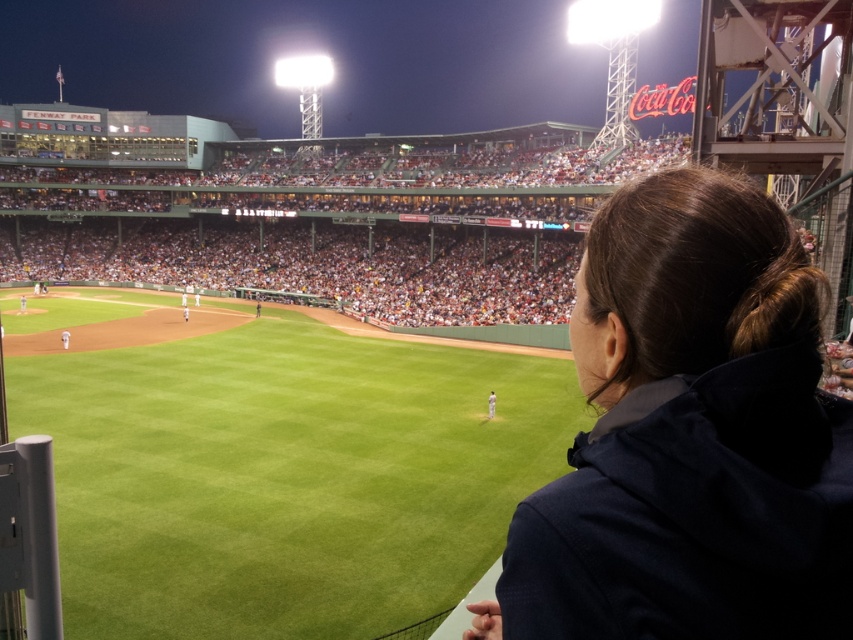
Question: Is dark blue jacket at upper right thinner than green grass baseball field at center?

Choices:
 (A) no
 (B) yes

Answer: (B)

Question: Which point is farther from the camera taking this photo?

Choices:
 (A) (659, 321)
 (B) (488, 404)
 (C) (270, 284)

Answer: (C)

Question: Among these points, which one is nearest to the camera?

Choices:
 (A) (148, 282)
 (B) (605, 237)
 (C) (491, 417)

Answer: (B)

Question: Considering the relative positions of dark blue jacket at upper right and white jersey uniform at center in the image provided, where is dark blue jacket at upper right located with respect to white jersey uniform at center?

Choices:
 (A) above
 (B) below

Answer: (A)

Question: Among these objects, which one is nearest to the camera?

Choices:
 (A) green grass baseball field at center
 (B) dark blue jacket at upper right
 (C) white jersey uniform at center

Answer: (B)

Question: Does dark blue jacket at upper right appear on the right side of white jersey uniform at center?

Choices:
 (A) no
 (B) yes

Answer: (A)